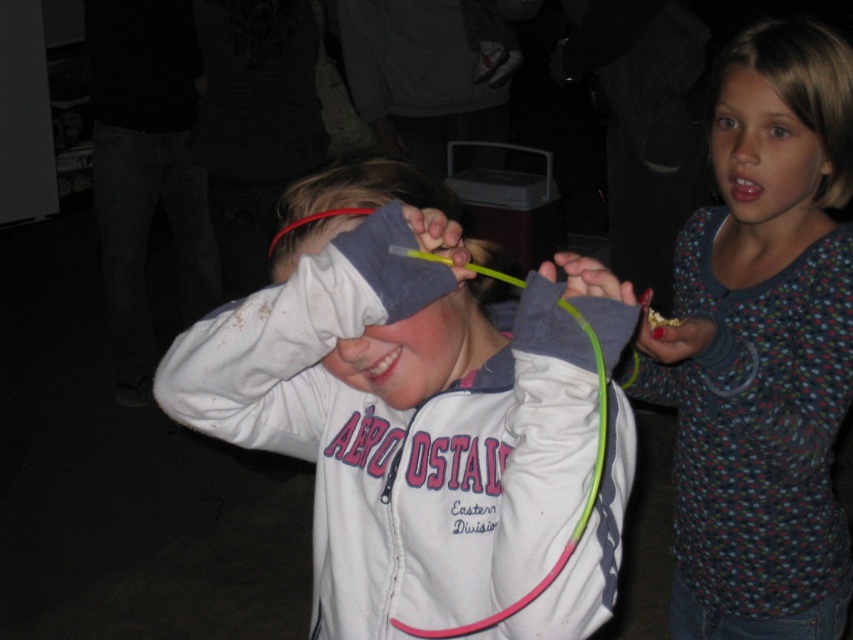
You are standing in the same room as the two children. Which of the two points, point [358,614] or point [779,138], is closer to you?

Point [358,614] is closer to the viewer than point [779,138].

You are a photographer trying to capture both the brown shiny eye at upper right and the blue eye at upper center in a single shot. Based on their sizes in the image, which eye would require you to zoom in more to ensure it is clearly visible?

The brown shiny eye at upper right occupies less space than the blue eye at upper center, so you would need to zoom in more on the brown shiny eye at upper right to ensure it is clearly visible.

Looking at the two eyes in the image, the brown shiny eye at upper right and the blue eye at upper center, which one is positioned to the right of the other?

The brown shiny eye at upper right is positioned to the right of the blue eye at upper center.